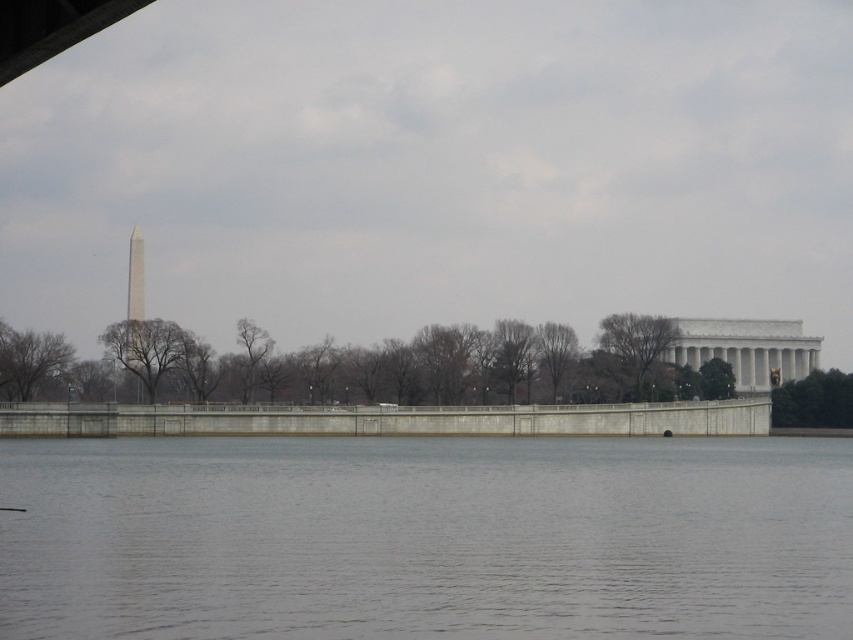
Is gray concrete river at center to the right of concrete wall at center from the viewer's perspective?

Yes, gray concrete river at center is to the right of concrete wall at center.

Who is lower down, gray concrete river at center or concrete wall at center?

concrete wall at center is below.

Identify the location of gray concrete river at center. Image resolution: width=853 pixels, height=640 pixels. (425, 538).